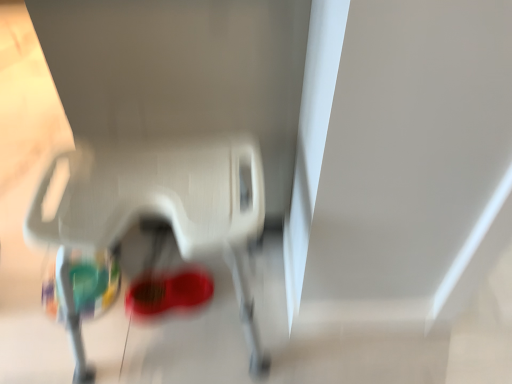
Question: Can we say white plastic baby carriage at lower center lies outside shiny red shoe at center?

Choices:
 (A) yes
 (B) no

Answer: (A)

Question: From the image's perspective, is white plastic baby carriage at lower center below shiny red shoe at center?

Choices:
 (A) no
 (B) yes

Answer: (A)

Question: Is white plastic baby carriage at lower center thinner than shiny red shoe at center?

Choices:
 (A) yes
 (B) no

Answer: (B)

Question: Does white plastic baby carriage at lower center turn towards shiny red shoe at center?

Choices:
 (A) no
 (B) yes

Answer: (A)

Question: Does white plastic baby carriage at lower center appear on the right side of shiny red shoe at center?

Choices:
 (A) no
 (B) yes

Answer: (B)

Question: Is white plastic baby carriage at lower center next to shiny red shoe at center and touching it?

Choices:
 (A) yes
 (B) no

Answer: (B)

Question: From the image's perspective, is shiny red shoe at center above white plastic baby carriage at lower center?

Choices:
 (A) yes
 (B) no

Answer: (B)

Question: Is shiny red shoe at center not near white plastic baby carriage at lower center?

Choices:
 (A) yes
 (B) no

Answer: (B)

Question: Does shiny red shoe at center have a greater height compared to white plastic baby carriage at lower center?

Choices:
 (A) yes
 (B) no

Answer: (B)

Question: Would you say shiny red shoe at center contains white plastic baby carriage at lower center?

Choices:
 (A) yes
 (B) no

Answer: (B)

Question: From the image's perspective, is shiny red shoe at center beneath white plastic baby carriage at lower center?

Choices:
 (A) yes
 (B) no

Answer: (A)

Question: Is the depth of shiny red shoe at center less than that of white plastic baby carriage at lower center?

Choices:
 (A) no
 (B) yes

Answer: (A)

Question: From a real-world perspective, is white plastic baby carriage at lower center physically located above or below shiny red shoe at center?

Choices:
 (A) above
 (B) below

Answer: (A)